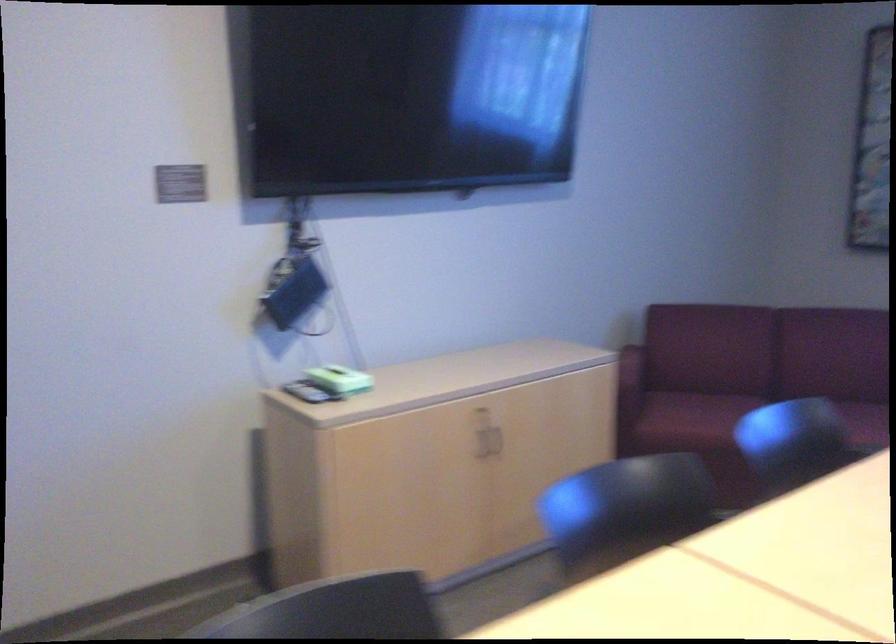
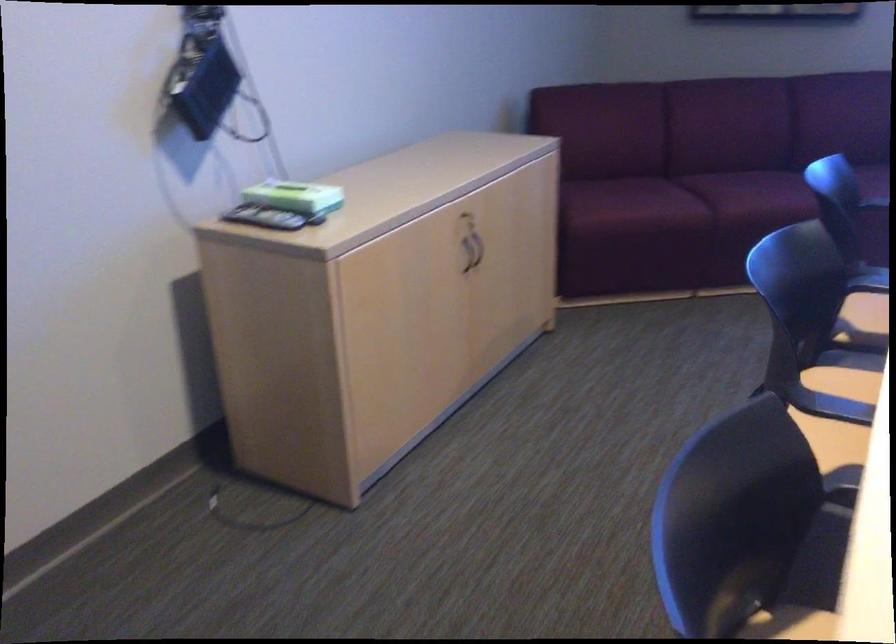
Where in the second image is the point corresponding to point 462,372 from the first image?

(428, 175)